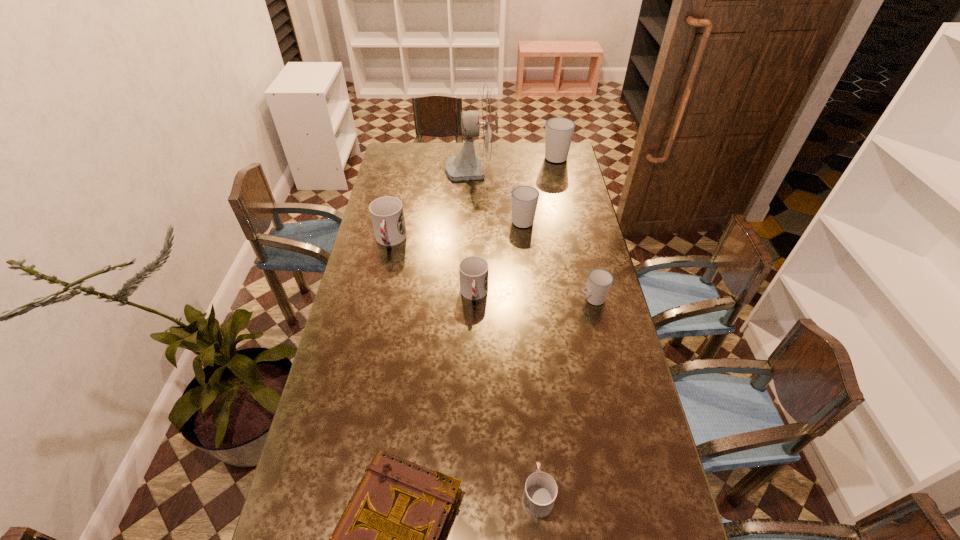
You are a GUI agent. You are given a task and a screenshot of the screen. Output one action in this format:
    pyautogui.click(x=<x>, y=<y>)
    Task: Click on the blank space located 0.320m with a handle on the side of the smallest white cup
    This screenshot has height=540, width=960.
    Given the screenshot: What is the action you would take?
    pyautogui.click(x=488, y=299)

You are a GUI agent. You are given a task and a screenshot of the screen. Output one action in this format:
    pyautogui.click(x=<x>, y=<y>)
    Task: Click on the vacant position located with a handle on the side of the smallest white cup
    
    Given the screenshot: What is the action you would take?
    pyautogui.click(x=557, y=299)

At what (x,y) coordinates should I click in order to perform the action: click on free space located on the side of the rightmost red cup where the handle is located. Please return your answer as a coordinate pair (x, y). The height and width of the screenshot is (540, 960). Looking at the image, I should click on (527, 374).

In order to click on free space located 0.190m on the side of the rightmost red cup where the handle is located in this screenshot , I will do `click(530, 404)`.

This screenshot has height=540, width=960. What are the coordinates of `free space located on the side of the rightmost red cup where the handle is located` in the screenshot? It's located at 527,368.

Locate an element on the screen. The height and width of the screenshot is (540, 960). fan that is positioned at the far edge is located at coordinates (483, 123).

Locate an element on the screen. cup that is at the far edge is located at coordinates (559, 131).

You are a GUI agent. You are given a task and a screenshot of the screen. Output one action in this format:
    pyautogui.click(x=<x>, y=<y>)
    Task: Click on the object located in the left edge section of the desktop
    The width and height of the screenshot is (960, 540).
    Given the screenshot: What is the action you would take?
    pyautogui.click(x=387, y=215)

The height and width of the screenshot is (540, 960). Identify the location of object at the far right corner. (559, 131).

The width and height of the screenshot is (960, 540). In the image, there is a desktop. In order to click on vacant space at the far edge in this screenshot , I will do `click(423, 148)`.